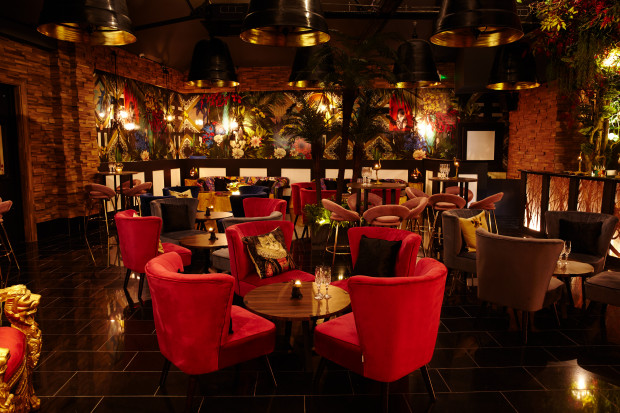
The height and width of the screenshot is (413, 620). Identify the location of black pillow. (374, 261).